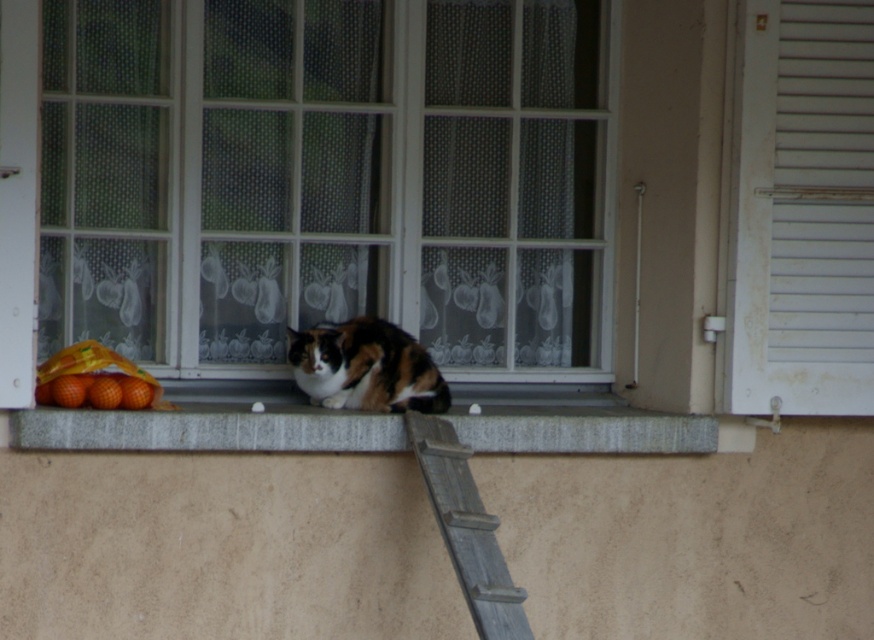
You are an interior designer assessing the space in the image. You need to place a large potted plant that requires a sturdy surface. Which object between the clear glass window at center and the rustic wood ladder at lower right is more suitable for placing the plant?

The clear glass window at center is larger in size than the rustic wood ladder at lower right, making it a more stable and suitable surface for placing the large potted plant.

You are a painter standing in front of the gray stone window sill at center and the rustic wood ladder at lower right. You want to paint both objects. Which object should you paint first if you follow the rule of painting closer objects before distant ones?

You should paint the gray stone window sill at center first because it is closer to you than the rustic wood ladder at lower right, which is further away.

You are trying to determine if the clear glass window at center can accommodate a large poster that is 1.2 meters wide. Given that the calico fur cat at center is sitting on the windowsill, can you estimate whether the window is wide enough?

The clear glass window at center might be wider than calico fur cat at center. Since the cat is on the windowsill, if the window is wider than the cat, it could potentially be wide enough for the poster, but without exact measurements, it is uncertain.